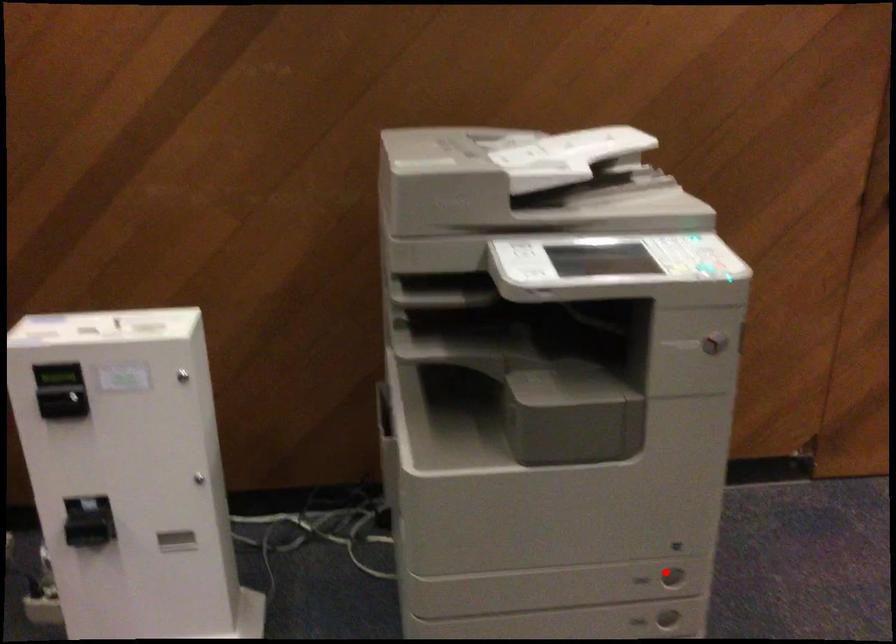
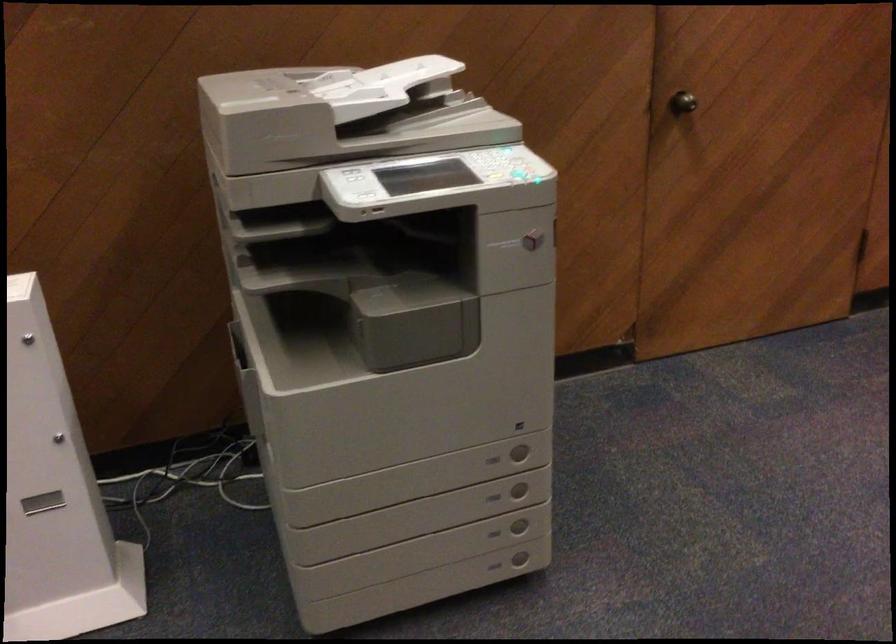
Question: I am providing you with two images of the same scene from different viewpoints. Image1 has a red point marked. In image2, the corresponding 3D location appears at what relative position? Reply with the corresponding letter.

Choices:
 (A) Closer
 (B) Farther

Answer: (B)